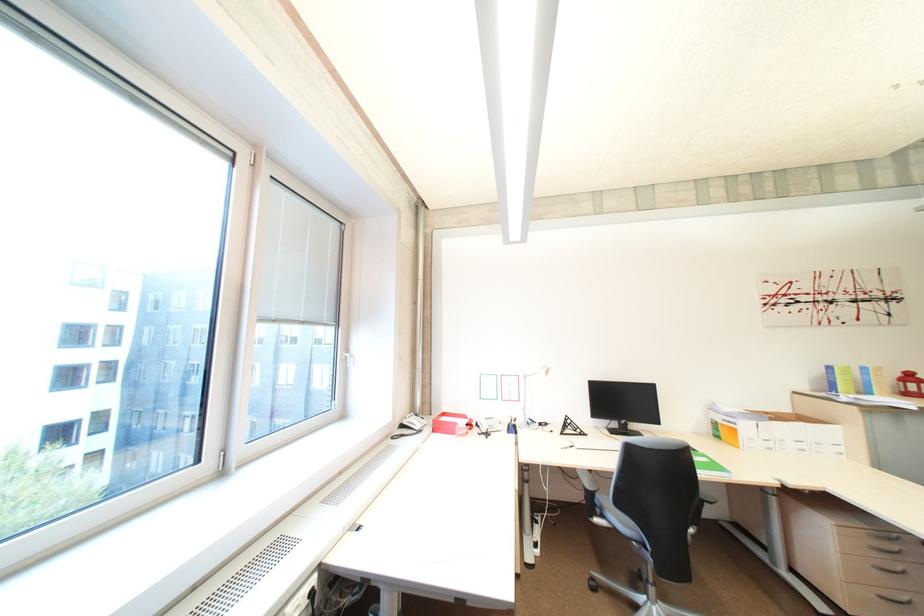
What do you see at coordinates (909, 384) in the screenshot?
I see `a red telephone handset` at bounding box center [909, 384].